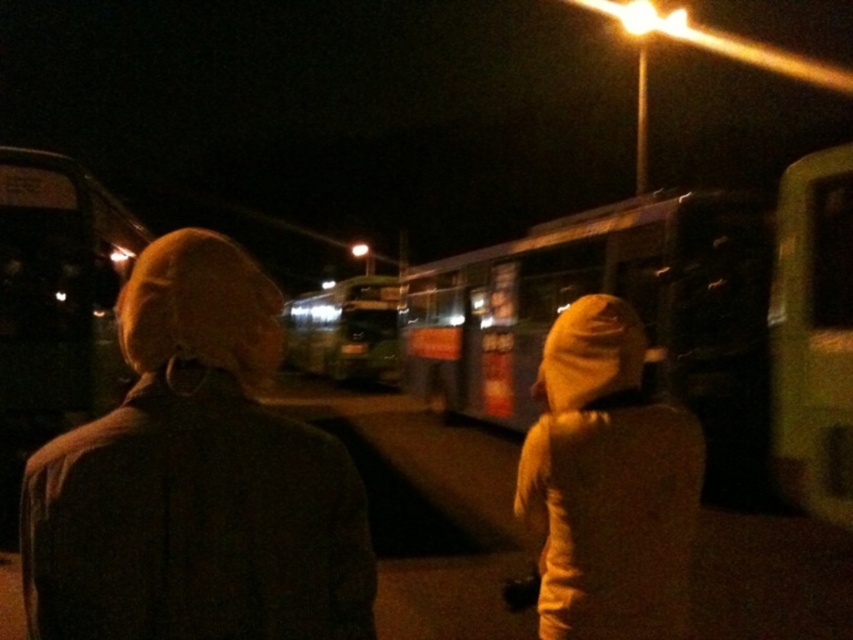
You are a pedestrian trying to cross the street at night. You see a brown woolen hat at upper left and a metallic green bus at center. Which object is closer to the ground?

The brown woolen hat at upper left is located below metallic green bus at center, so it is closer to the ground.